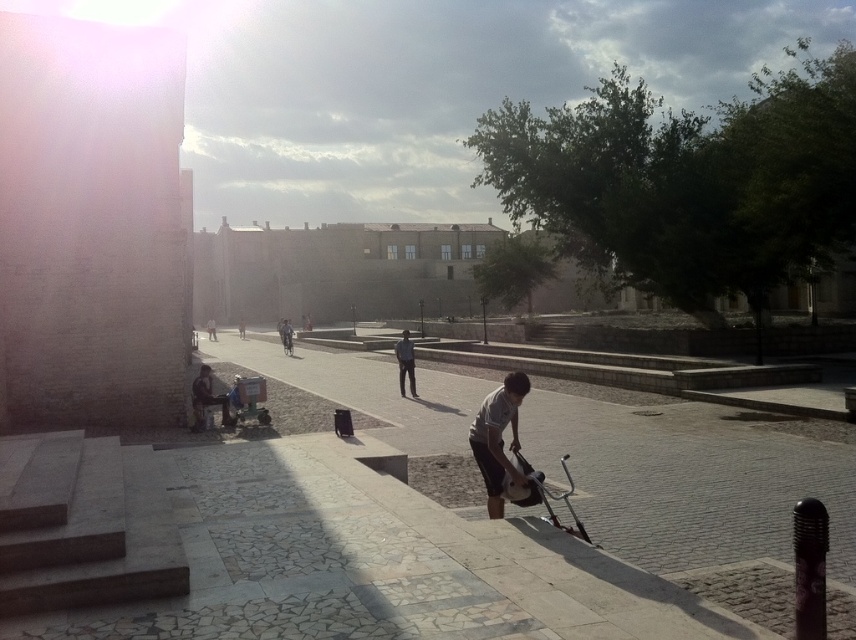
Looking at this image, you are a delivery person who needs to move a package from the gray matte skateboard at center to the metallic silver baby carriage at lower right. Is the skateboard currently blocking access to the baby carriage?

The gray matte skateboard at center is positioned over metallic silver baby carriage at lower right, so yes, the skateboard is blocking access to the baby carriage.

You are standing at the point marked by the coordinates point (x=498, y=440) in the image. What object are you currently standing on?

The point (x=498, y=440) is on the gray matte skateboard at center, so you are standing on the gray matte skateboard at center.